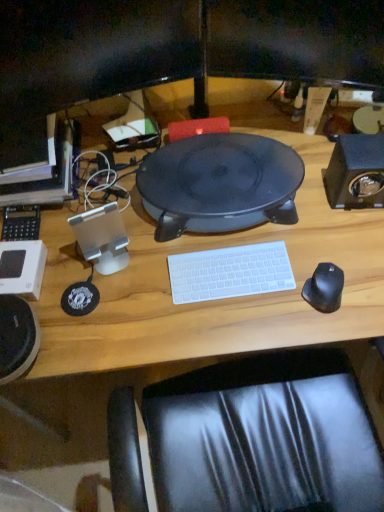
Where is `vacant area to the right of white plastic keyboard at center`? This screenshot has width=384, height=512. vacant area to the right of white plastic keyboard at center is located at coordinates (312, 267).